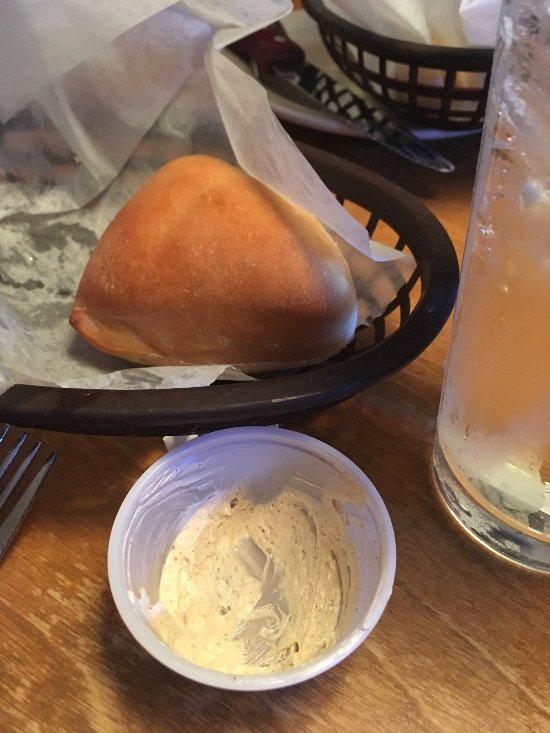
Locate an element on the screen. table is located at coordinates (463, 676).